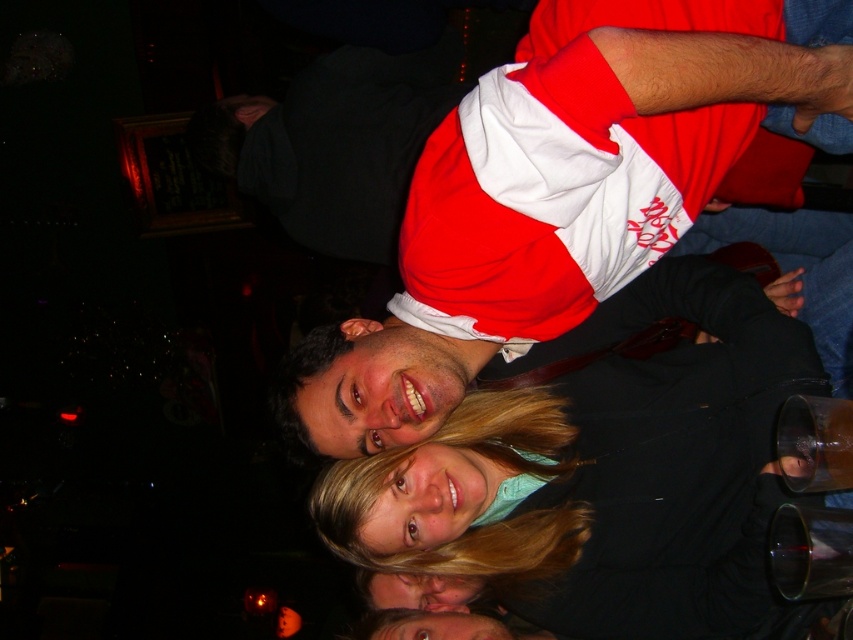
Does matte black jacket at center have a greater width compared to red and white jersey at center?

Indeed, matte black jacket at center has a greater width compared to red and white jersey at center.

Can you confirm if matte black jacket at center is positioned below red and white jersey at center?

Indeed, matte black jacket at center is positioned under red and white jersey at center.

Who is more forward, (612, 499) or (543, 13)?

Positioned in front is point (543, 13).

What are the coordinates of `matte black jacket at center` in the screenshot? It's located at (599, 474).